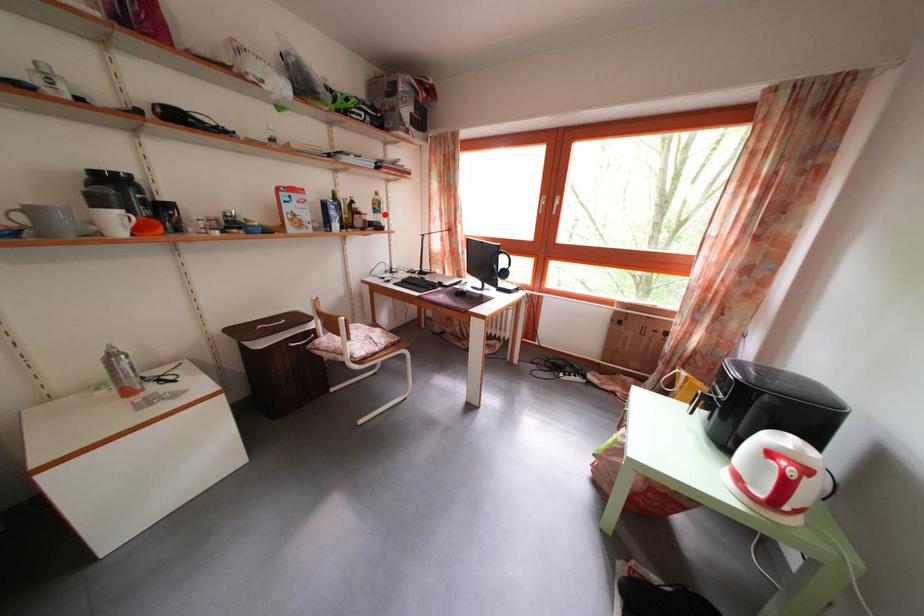
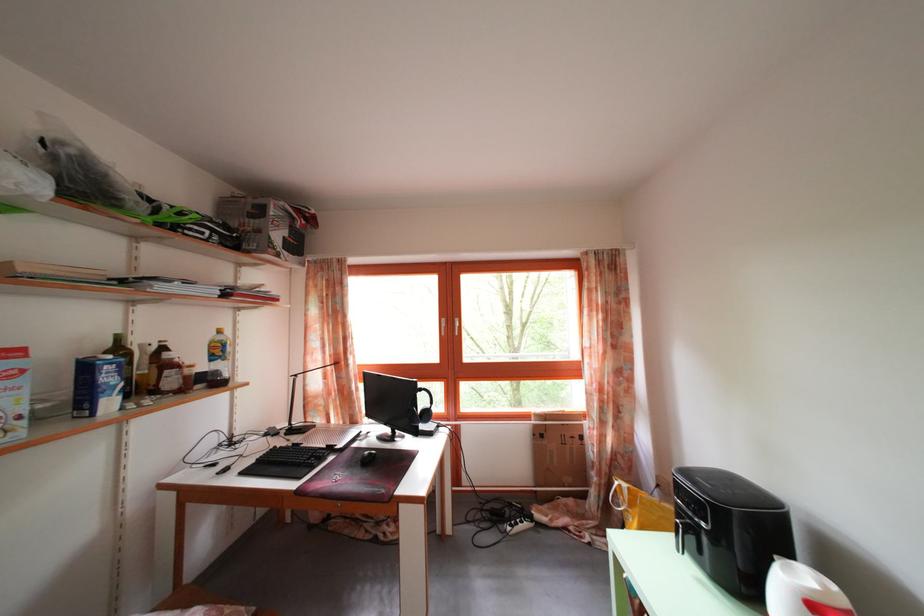
In the second image, find the point that corresponds to the highlighted location in the first image.

(225, 359)